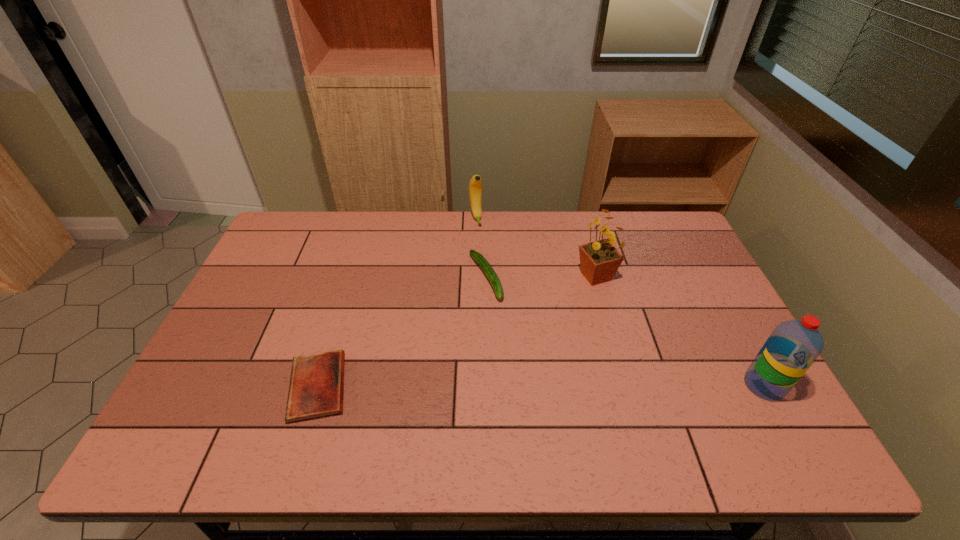
The height and width of the screenshot is (540, 960). In order to click on vacant spot on the desktop that is between the leftmost object and the water bottle and is positioned at the front of the fourth object from left to right with flowers visible in this screenshot , I will do `click(551, 386)`.

Where is `free space on the desktop that is between the leftmost object and the water bottle and is positioned on the front-facing side of the second shortest object`? The width and height of the screenshot is (960, 540). free space on the desktop that is between the leftmost object and the water bottle and is positioned on the front-facing side of the second shortest object is located at coordinates (552, 386).

The width and height of the screenshot is (960, 540). Find the location of `free space on the desktop that is between the diary and the water bottle and is positioned from the stem of the third tallest object`. free space on the desktop that is between the diary and the water bottle and is positioned from the stem of the third tallest object is located at coordinates (534, 386).